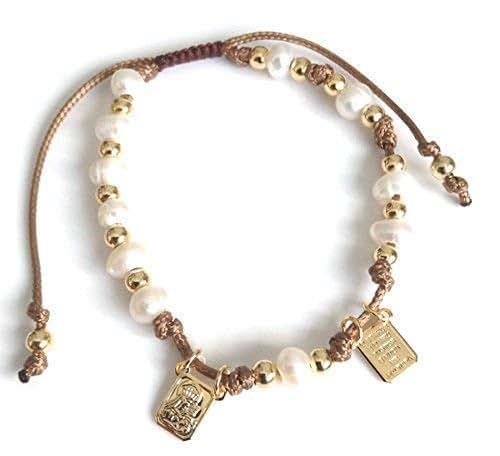
The width and height of the screenshot is (500, 456). In order to click on white surface in this screenshot , I will do coord(276,244).